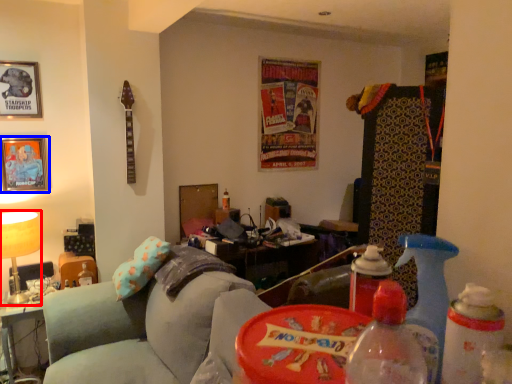
Question: Which object is closer to the camera taking this photo, table lamp (highlighted by a red box) or picture frame (highlighted by a blue box)?

Choices:
 (A) table lamp
 (B) picture frame

Answer: (A)